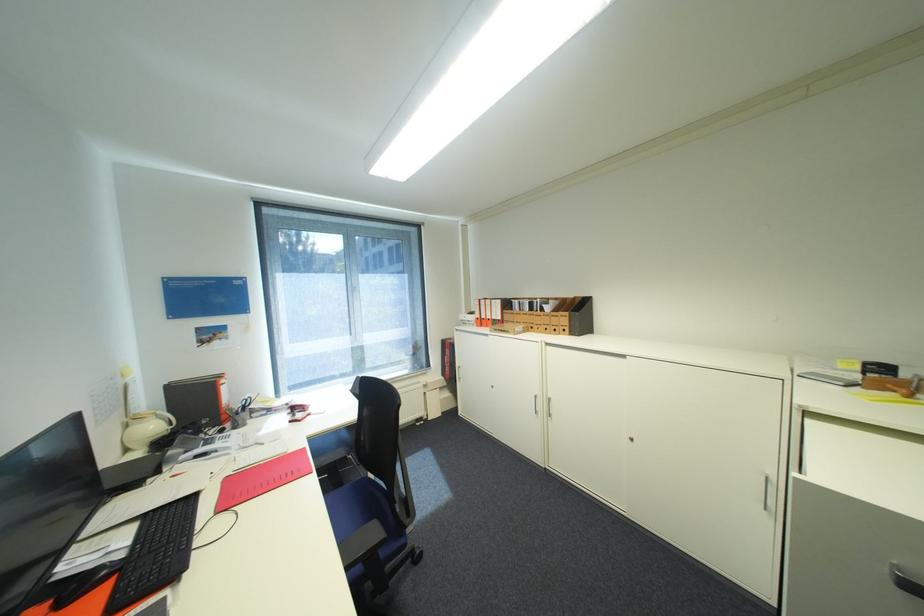
I want to click on red stapler, so click(x=894, y=385).